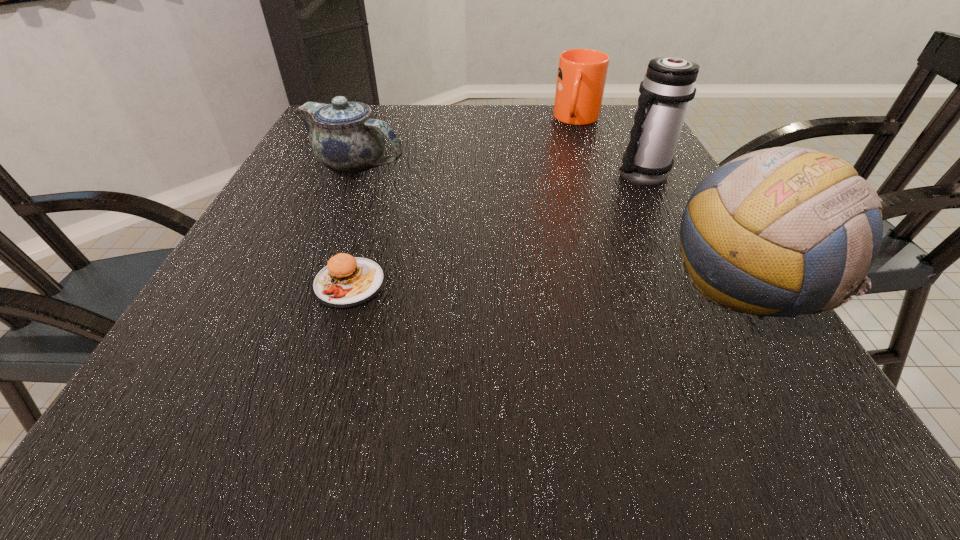
Locate an element on the screen. vacant space on the desktop that is between the patty and the volleyball and is positioned on the handle side of the mug is located at coordinates (540, 285).

This screenshot has width=960, height=540. Find the location of `vacant space on the desktop that is between the patty and the volleyball and is positioned from the spout of the chinaware`. vacant space on the desktop that is between the patty and the volleyball and is positioned from the spout of the chinaware is located at coordinates (567, 285).

At what (x,y) coordinates should I click in order to perform the action: click on vacant space on the desktop that is between the patty and the volleyball and is positioned on the side with the handle of the thermos bottle. Please return your answer as a coordinate pair (x, y). This screenshot has width=960, height=540. Looking at the image, I should click on (494, 284).